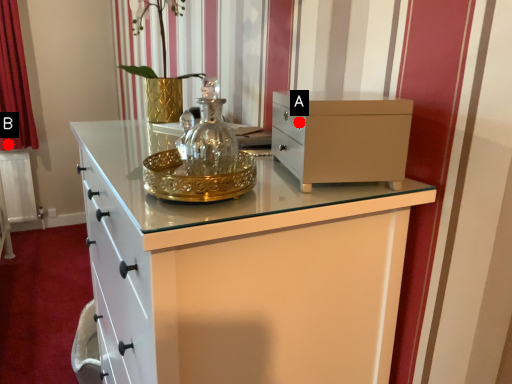
Question: Two points are circled on the image, labeled by A and B beside each circle. Among these points, which one is farthest from the camera?

Choices:
 (A) A is further
 (B) B is further

Answer: (B)